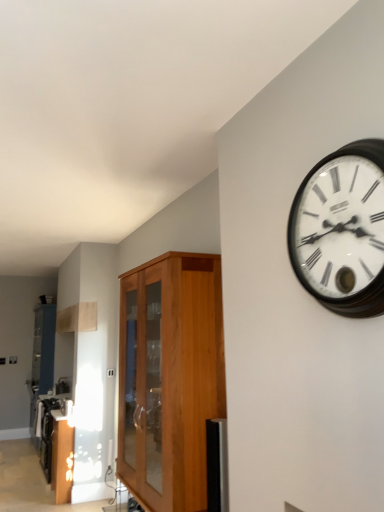
This screenshot has width=384, height=512. Describe the element at coordinates (342, 230) in the screenshot. I see `wooden wall clock at upper right` at that location.

Measure the distance between point (69,402) and camera.

A distance of 4.38 meters exists between point (69,402) and camera.

Where is `wooden cabinet at center`? This screenshot has height=512, width=384. wooden cabinet at center is located at coordinates (169, 378).

Which is in front, point (66, 402) or point (139, 308)?

Positioned in front is point (139, 308).

From the image's perspective, who appears lower, metallic stainless steel toaster at lower left or wooden cabinet at center?

metallic stainless steel toaster at lower left.

Could you tell me if metallic stainless steel toaster at lower left is turned towards wooden cabinet at center?

No, metallic stainless steel toaster at lower left does not turn towards wooden cabinet at center.

Is point (337, 215) positioned in front of point (136, 460)?

Yes, it is in front of point (136, 460).

How distant is wooden wall clock at upper right from wooden cabinet at center?

wooden wall clock at upper right is 4.43 feet from wooden cabinet at center.

Is the surface of wooden wall clock at upper right in direct contact with wooden cabinet at center?

wooden wall clock at upper right and wooden cabinet at center are not in contact.

Which of these two, wooden wall clock at upper right or wooden cabinet at center, stands shorter?

wooden wall clock at upper right.

Considering the positions of point (153, 474) and point (61, 404), is point (153, 474) closer or farther from the camera than point (61, 404)?

Point (153, 474) appears to be closer to the viewer than point (61, 404).

Could metallic stainless steel toaster at lower left be considered to be inside wooden cabinet at center?

No.

From a real-world perspective, is wooden cabinet at center physically located above or below metallic stainless steel toaster at lower left?

wooden cabinet at center is above metallic stainless steel toaster at lower left.

How different are the orientations of wooden cabinet at center and metallic stainless steel toaster at lower left in degrees?

0.493 degrees separate the facing orientations of wooden cabinet at center and metallic stainless steel toaster at lower left.

Is wooden wall clock at upper right inside the boundaries of metallic stainless steel toaster at lower left, or outside?

wooden wall clock at upper right is not enclosed by metallic stainless steel toaster at lower left.

From a real-world perspective, relative to metallic stainless steel toaster at lower left, is wooden wall clock at upper right vertically above or below?

wooden wall clock at upper right is situated higher than metallic stainless steel toaster at lower left in the real world.

Is there a large distance between wooden wall clock at upper right and metallic stainless steel toaster at lower left?

Absolutely, wooden wall clock at upper right is distant from metallic stainless steel toaster at lower left.

What's the angular difference between wooden wall clock at upper right and metallic stainless steel toaster at lower left's facing directions?

They differ by 0.579 degrees in their facing directions.

Between wooden cabinet at center and wooden wall clock at upper right, which one is positioned in front?

wooden wall clock at upper right.

Would you say wooden cabinet at center is inside or outside wooden wall clock at upper right?

wooden cabinet at center is spatially situated outside wooden wall clock at upper right.

From a real-world perspective, relative to wooden wall clock at upper right, is wooden cabinet at center vertically above or below?

From a real-world perspective, wooden cabinet at center is physically below wooden wall clock at upper right.

Based on the photo, would you say wooden cabinet at center is to the left or to the right of wooden wall clock at upper right in the picture?

Based on their positions, wooden cabinet at center is located to the left of wooden wall clock at upper right.

From a real-world perspective, is metallic stainless steel toaster at lower left physically located above or below wooden wall clock at upper right?

metallic stainless steel toaster at lower left is below wooden wall clock at upper right.

Looking at this image, what's the angular difference between metallic stainless steel toaster at lower left and wooden wall clock at upper right's facing directions?

The angular difference between metallic stainless steel toaster at lower left and wooden wall clock at upper right is 0.579 degrees.

Is metallic stainless steel toaster at lower left in front of wooden wall clock at upper right?

No.

Where is `appliance that is under the wooden wall clock at upper right (from a real-world perspective)`? appliance that is under the wooden wall clock at upper right (from a real-world perspective) is located at coordinates (66, 407).

At what (x,y) coordinates should I click in order to perform the action: click on appliance that appears below the wooden cabinet at center (from a real-world perspective). Please return your answer as a coordinate pair (x, y). The height and width of the screenshot is (512, 384). Looking at the image, I should click on (66, 407).

Locate an element on the screen. The image size is (384, 512). cabinetry that is below the wooden wall clock at upper right (from the image's perspective) is located at coordinates (169, 378).

Considering their positions, is metallic stainless steel toaster at lower left positioned further to wooden cabinet at center than wooden wall clock at upper right?

metallic stainless steel toaster at lower left.

Looking at the image, which one is located closer to wooden wall clock at upper right, metallic stainless steel toaster at lower left or wooden cabinet at center?

The object closer to wooden wall clock at upper right is wooden cabinet at center.

Estimate the real-world distances between objects in this image. Which object is closer to metallic stainless steel toaster at lower left, wooden wall clock at upper right or wooden cabinet at center?

wooden cabinet at center lies closer to metallic stainless steel toaster at lower left than the other object.

Based on their spatial positions, is wooden cabinet at center or wooden wall clock at upper right closer to metallic stainless steel toaster at lower left?

Among the two, wooden cabinet at center is located nearer to metallic stainless steel toaster at lower left.

When comparing their distances from wooden wall clock at upper right, does wooden cabinet at center or metallic stainless steel toaster at lower left seem further?

metallic stainless steel toaster at lower left.

When comparing their distances from wooden cabinet at center, does wooden wall clock at upper right or metallic stainless steel toaster at lower left seem further?

metallic stainless steel toaster at lower left.

At what (x,y) coordinates should I click in order to perform the action: click on cabinetry between wooden wall clock at upper right and metallic stainless steel toaster at lower left from front to back. Please return your answer as a coordinate pair (x, y). This screenshot has width=384, height=512. Looking at the image, I should click on (169, 378).